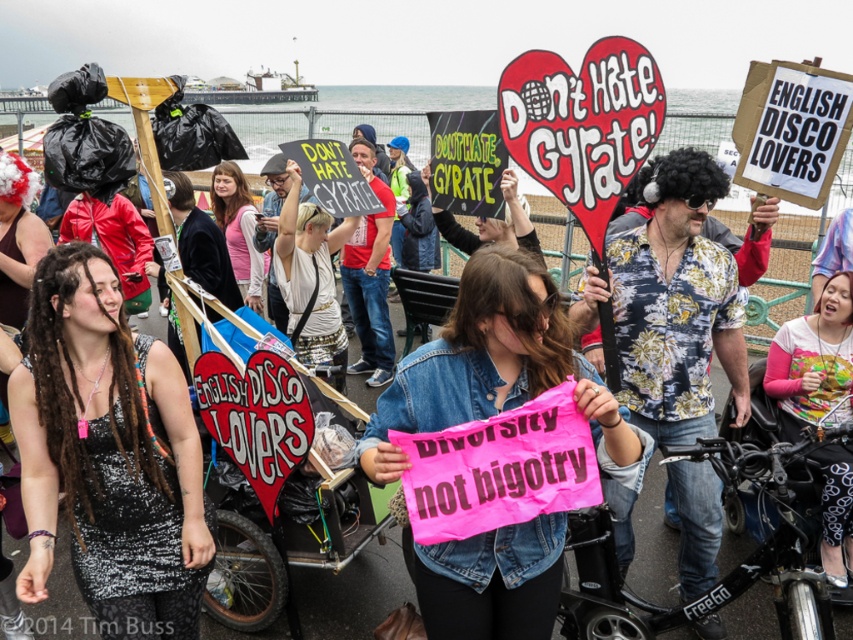
You are a photographer at the protest and want to take a photo of both the pink fabric shirt at lower right and the pink fabric shirt at center. Which one should you focus on first to ensure both are in the frame?

You should focus on the pink fabric shirt at lower right first because it is closer to the viewer than the pink fabric shirt at center, so adjusting the camera to include both would require starting with the closer one and then framing the farther one behind it.